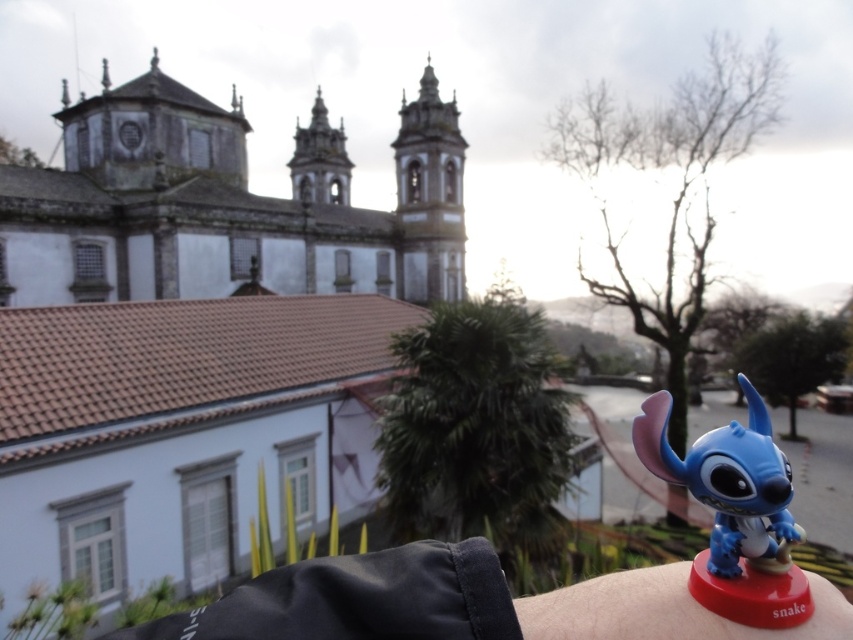
Based on the photo, does blue matte toy at lower right have a lesser height compared to blue plastic toy at lower right?

Incorrect, blue matte toy at lower right's height does not fall short of blue plastic toy at lower right's.

Is point (805, 605) more distant than point (808, 618)?

Yes, it is behind point (808, 618).

Who is more distant from viewer, (x=773, y=508) or (x=554, y=627)?

The point (x=554, y=627) is more distant.

You are a GUI agent. You are given a task and a screenshot of the screen. Output one action in this format:
    pyautogui.click(x=<x>, y=<y>)
    Task: Click on the blue matte toy at lower right
    The width and height of the screenshot is (853, 640).
    Given the screenshot: What is the action you would take?
    pyautogui.click(x=734, y=513)

The image size is (853, 640). Describe the element at coordinates (465, 604) in the screenshot. I see `blue matte toy at upper right` at that location.

Which is more to the left, blue matte toy at upper right or blue plastic toy at lower right?

Positioned to the left is blue matte toy at upper right.

The width and height of the screenshot is (853, 640). What do you see at coordinates (465, 604) in the screenshot? I see `blue matte toy at upper right` at bounding box center [465, 604].

Locate an element on the screen. The width and height of the screenshot is (853, 640). blue matte toy at upper right is located at coordinates (465, 604).

Does blue matte toy at upper right appear under blue matte toy at lower right?

Correct, blue matte toy at upper right is located below blue matte toy at lower right.

Does blue matte toy at upper right have a smaller size compared to blue matte toy at lower right?

Yes, blue matte toy at upper right is smaller than blue matte toy at lower right.

Identify the location of blue matte toy at upper right. (465, 604).